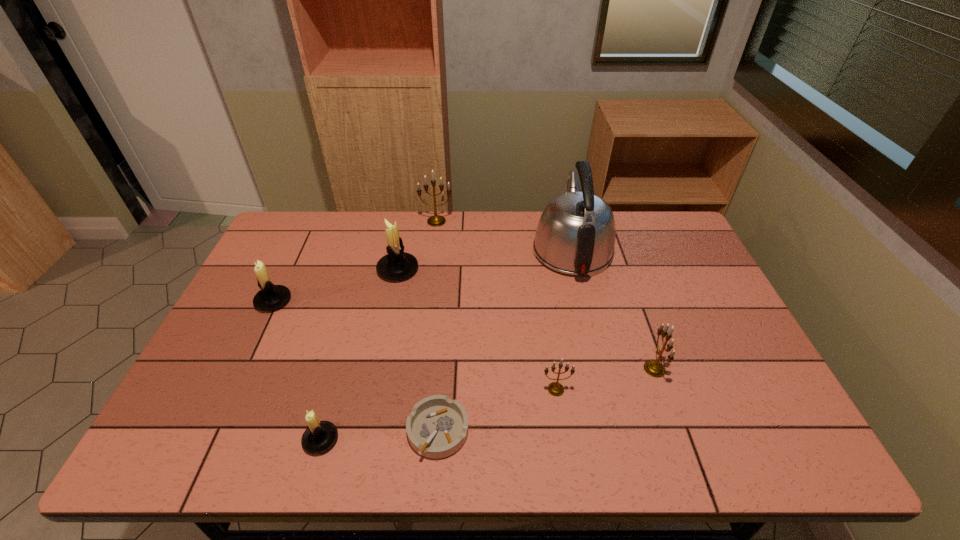
You are a GUI agent. You are given a task and a screenshot of the screen. Output one action in this format:
    pyautogui.click(x=<x>, y=<y>)
    Task: Click on the gray kettle
    The width and height of the screenshot is (960, 540).
    Given the screenshot: What is the action you would take?
    pyautogui.click(x=575, y=235)

The height and width of the screenshot is (540, 960). In order to click on kettle in this screenshot , I will do `click(575, 235)`.

You are a GUI agent. You are given a task and a screenshot of the screen. Output one action in this format:
    pyautogui.click(x=<x>, y=<y>)
    Task: Click on the farthest candle holder
    The width and height of the screenshot is (960, 540).
    Given the screenshot: What is the action you would take?
    pyautogui.click(x=436, y=220)

The width and height of the screenshot is (960, 540). Find the location of `the leftmost gold candelabrum`. the leftmost gold candelabrum is located at coordinates (436, 220).

In order to click on the farthest white candle holder in this screenshot , I will do `click(396, 265)`.

This screenshot has height=540, width=960. I want to click on the biggest white candle holder, so click(x=396, y=265).

Identify the location of the second farthest white candle holder. This screenshot has height=540, width=960. (270, 297).

I want to click on the fifth nearest object, so click(270, 297).

Where is `the second smallest gold candelabrum`? the second smallest gold candelabrum is located at coordinates (654, 368).

Identify the location of the rightmost candle holder. The width and height of the screenshot is (960, 540). (654, 368).